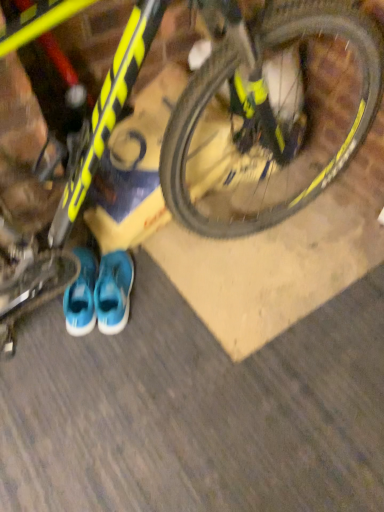
Locate an element on the screen. vacant area that lies to the right of blue fabric running shoe at lower center is located at coordinates (165, 287).